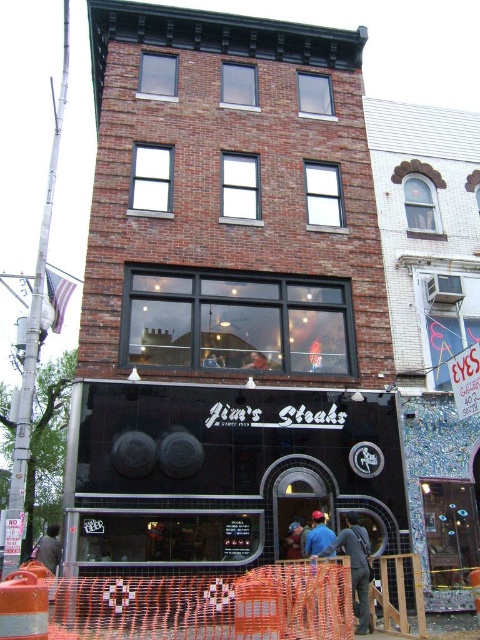
You are a delivery person trying to enter the building through the black glass storefront at center. There is a dark gray fabric construction worker at lower center blocking the entrance. Can you pass through the entrance without moving the construction worker?

The black glass storefront at center is bigger than the dark gray fabric construction worker at lower center, so yes, you can pass through the entrance without moving the construction worker because the storefront is larger and provides enough space around the worker.

You are a delivery person trying to see the store name on the black glass storefront at center. Can you see it clearly from where the dark gray fabric construction worker at lower center is standing?

The black glass storefront at center is above the dark gray fabric construction worker at lower center, so the worker can look up to see the store name clearly.